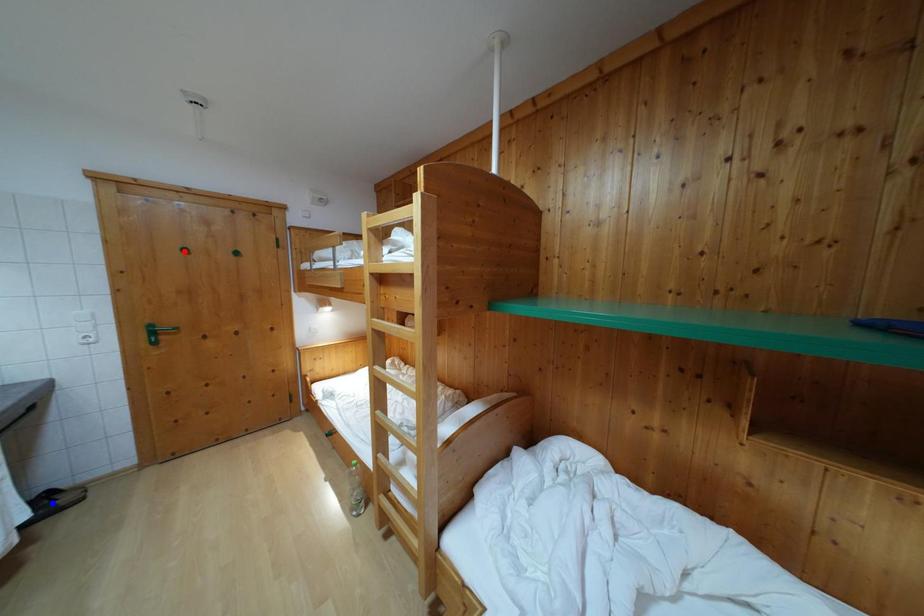
Question: In the image, two points are highlighted. Which point is nearer to the camera? Reply with the corresponding letter.

Choices:
 (A) blue point
 (B) red point

Answer: (A)